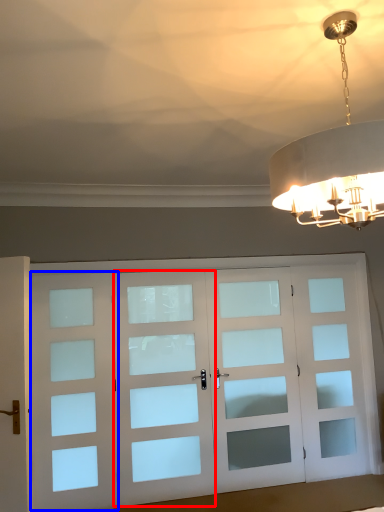
Question: Among these objects, which one is farthest to the camera, screen door (highlighted by a red box) or screen door (highlighted by a blue box)?

Choices:
 (A) screen door
 (B) screen door

Answer: (A)